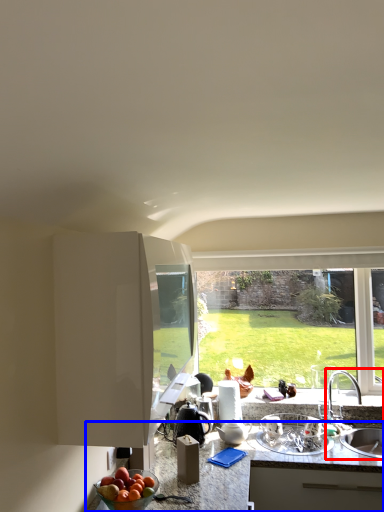
Question: Which point is further to the camera, sink (highlighted by a red box) or countertop (highlighted by a blue box)?

Choices:
 (A) sink
 (B) countertop

Answer: (A)